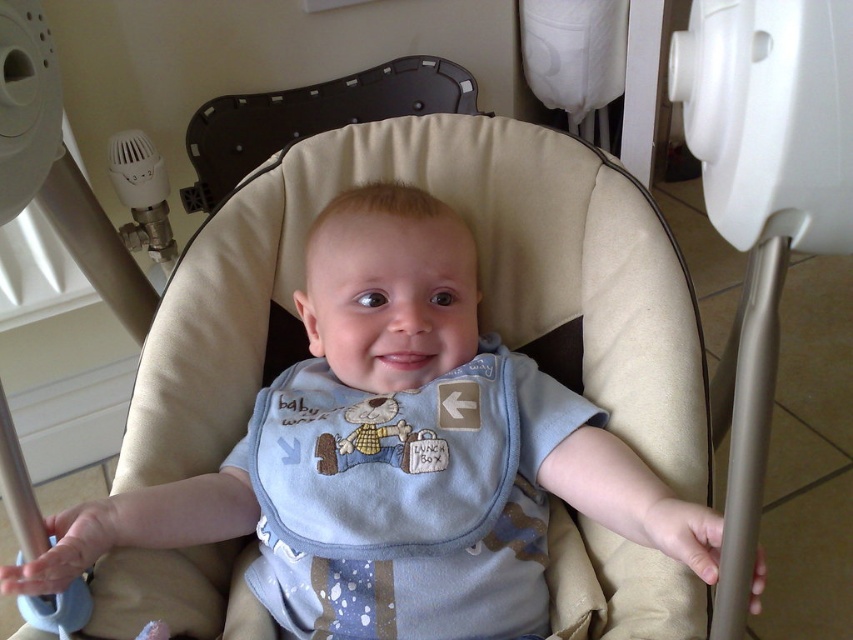
You are a photographer setting up for a baby photo shoot. You need to position two lights for optimal lighting. The first light should be placed at point (316, 499) and the second light at point (415, 205). From the baby bouncer chair, which light is closer to the camera?

Point (316, 499) is in front of point (415, 205), so the first light placed at point (316, 499) is closer to the camera.

You are a photographer taking a picture of the baby. You notice two bibs on the baby. Which bib is closer to you, the blue cotton bib at center or the light blue fabric bib at center?

The blue cotton bib at center is closer to you since it is further to the viewer than the light blue fabric bib at center.

You are a photographer setting up for a baby photoshoot. You notice the light blue fabric bib at center and the black plastic feeding chair at upper center. Which object should you focus on first to ensure sharpness in your photo?

The light blue fabric bib at center is closer to the viewer than the black plastic feeding chair at upper center, so you should focus on the light blue fabric bib at center first to ensure sharpness.